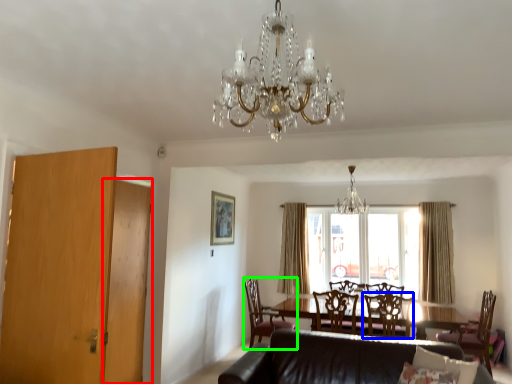
Question: Considering the real-world distances, which object is closest to armoire (highlighted by a red box)? chair (highlighted by a blue box) or chair (highlighted by a green box).

Choices:
 (A) chair
 (B) chair

Answer: (A)